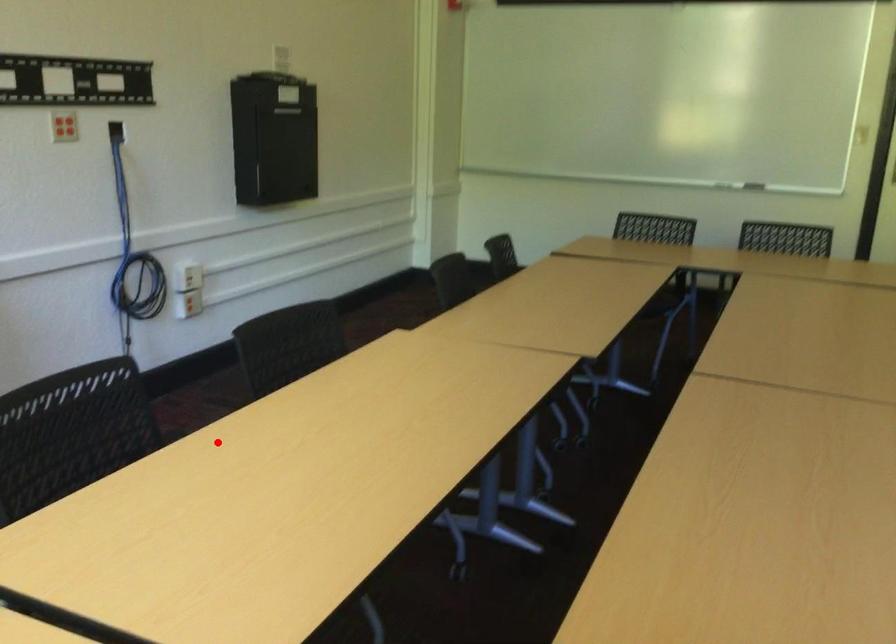
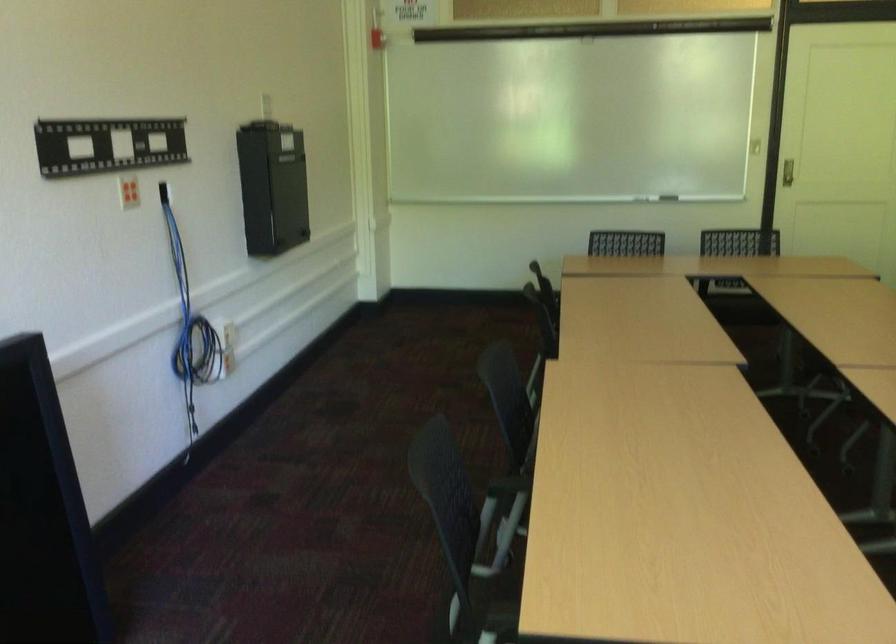
Question: I am providing you with two images of the same scene from different viewpoints. A red point is shown in image1. For the corresponding object point in image2, is it positioned nearer or farther from the camera?

Choices:
 (A) Nearer
 (B) Farther

Answer: (B)